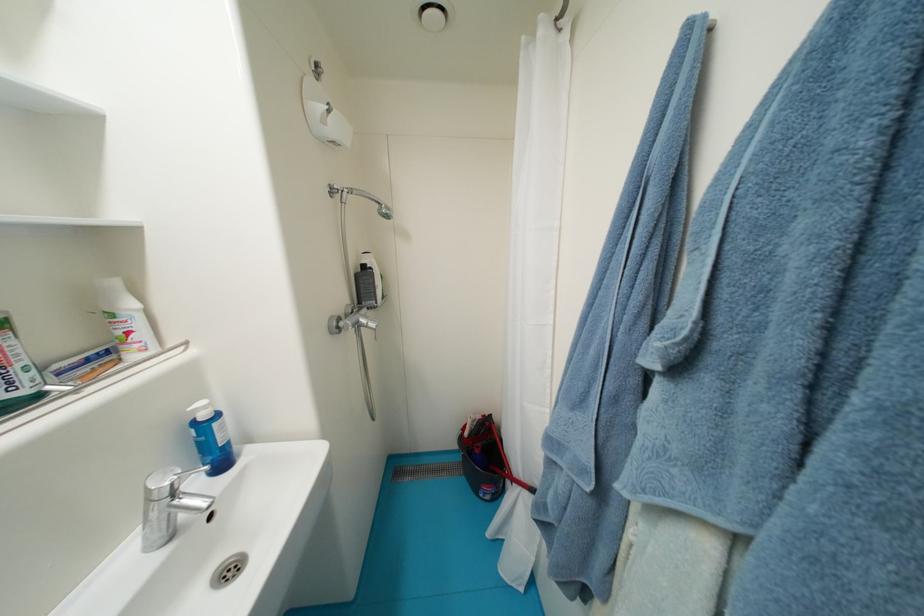
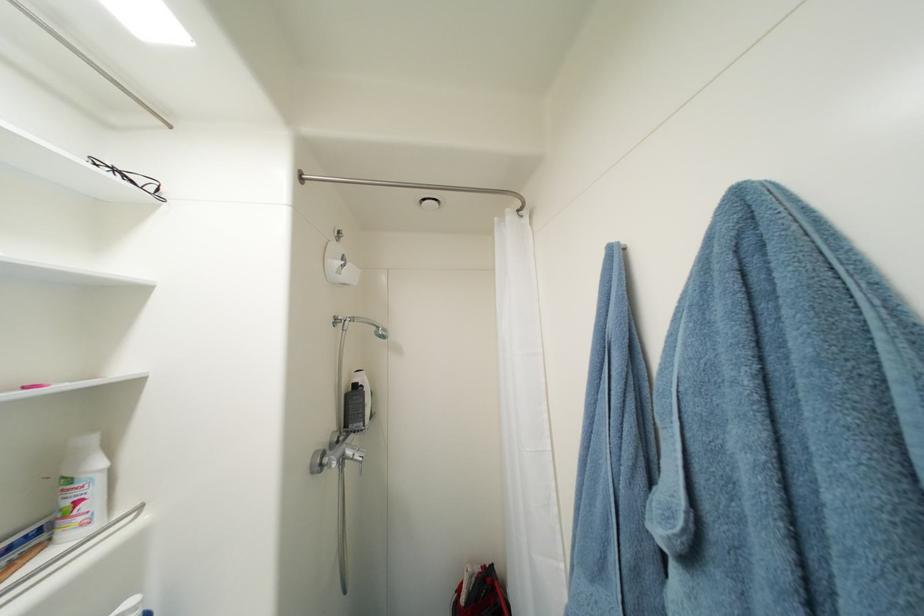
The point at (472,436) is marked in the first image. Where is the corresponding point in the second image?

(469, 602)